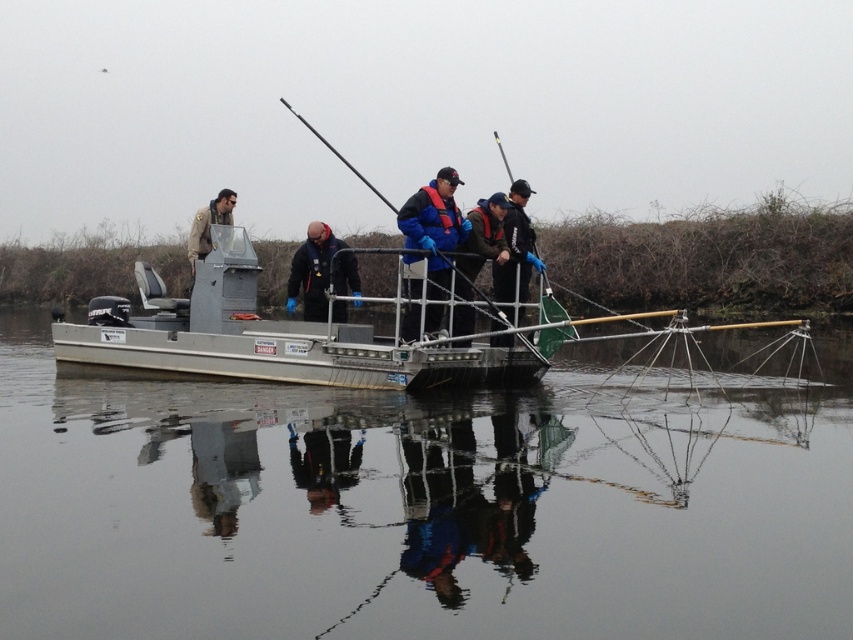
You are a researcher on the boat and need to take a photo of the net structure. You have a camera and a dark blue jacket at center. Which item is closer to the net structure?

The dark blue jacket at center is closer to the net structure because it is only 10.92 meters away from the camera, which is likely positioned near the net structure. However, the description states the distance between the jacket and the camera, not the net. To accurately determine proximity to the net, more information about the camera and net positions is needed.

What is the exact coordinate of the dark blue jacket at center?

The dark blue jacket at center is located at coordinate point [320,272].

You are a photographer on the boat and need to decide which jacket to wear for taking photos. The blue fleece jacket at center is more comfortable for movement, but the dark blue jacket at center is warmer. Which jacket is thinner and thus easier to move in?

The blue fleece jacket at center is thinner than the dark blue jacket at center, making it easier to move in for taking photos.